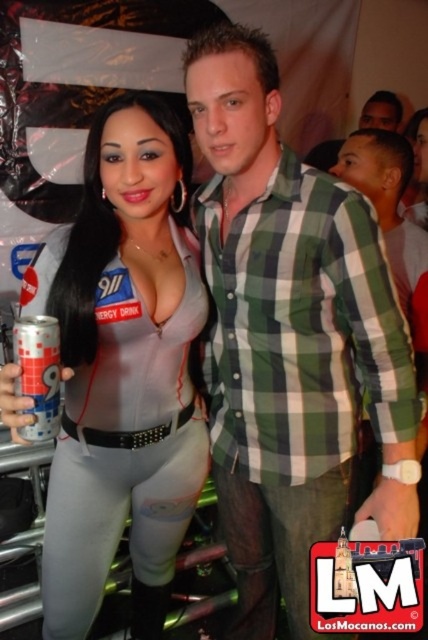
You are standing at the point where the photographer is located. You want to take a photo of the two people in the scene. If you move forward by 0.5 meters, will the point at coordinates point (338, 468) become closer to you?

The distance of point (338, 468) from viewer is 1.18 meters. If you move forward by 0.5 meters, the new distance would be 1.18 minus 0.5, which equals 0.68 meters. Therefore, the point at coordinates point (338, 468) would indeed become closer to you.

You are at a costume party and need to take a photo with the silver metallic can at left and the green plaid shirt at center. Where should you stand to ensure both items are visible in the frame?

You should stand in a position where the green plaid shirt at center is below the silver metallic can at left, ensuring both are within the camera frame.